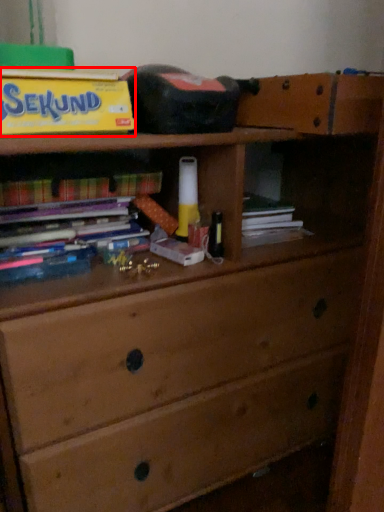
Question: Where is paperback book (annotated by the red box) located in relation to book in the image?

Choices:
 (A) left
 (B) right

Answer: (A)